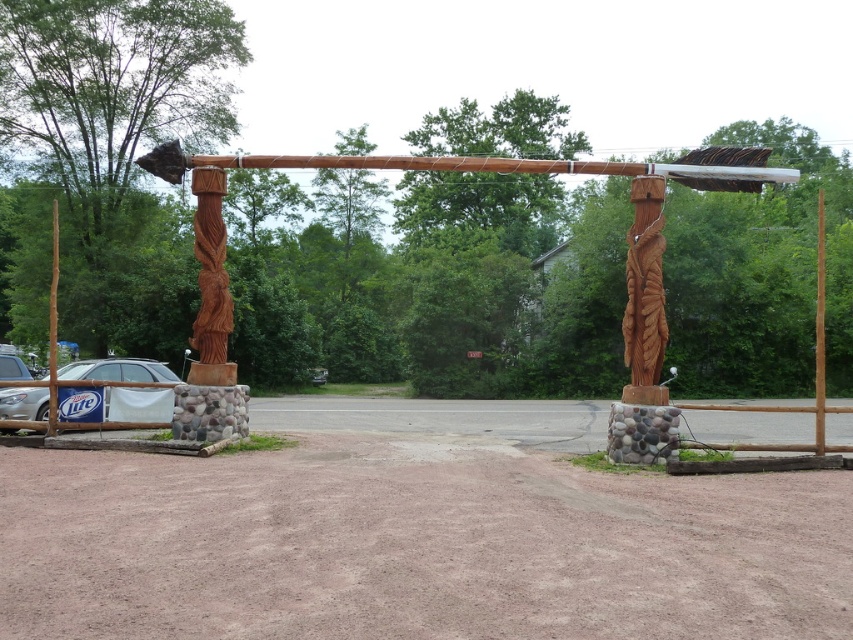
Can you confirm if brown gravel dirt track at center is shorter than silver metallic car at lower left?

Yes, brown gravel dirt track at center is shorter than silver metallic car at lower left.

Between brown gravel dirt track at center and silver metallic car at lower left, which one has more height?

silver metallic car at lower left is taller.

Where is `brown gravel dirt track at center`? The image size is (853, 640). brown gravel dirt track at center is located at coordinates (413, 545).